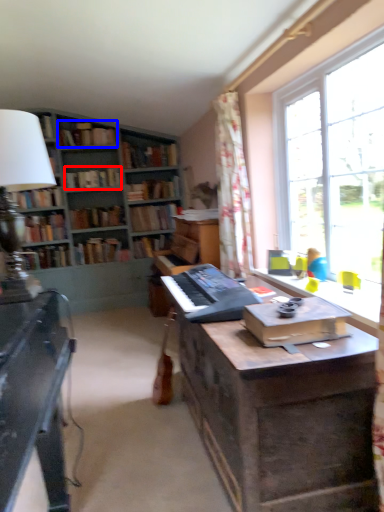
Question: Which of the following is the closest to the observer, book (highlighted by a red box) or book (highlighted by a blue box)?

Choices:
 (A) book
 (B) book

Answer: (B)